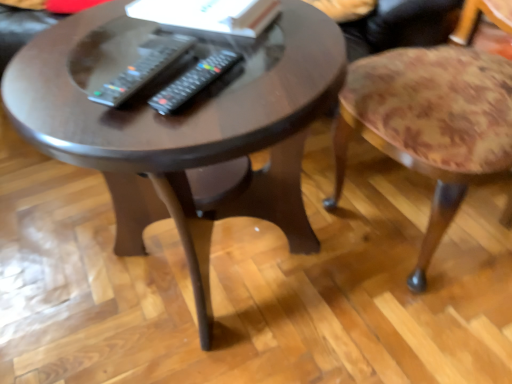
I want to click on free space in front of floral fabric stool at right, so click(428, 322).